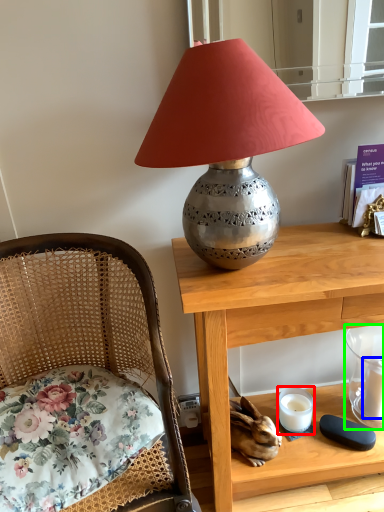
Question: Which object is the closest to the candle holder (highlighted by a red box)? Choose among these: candle (highlighted by a blue box) or candle holder (highlighted by a green box).

Choices:
 (A) candle
 (B) candle holder

Answer: (B)